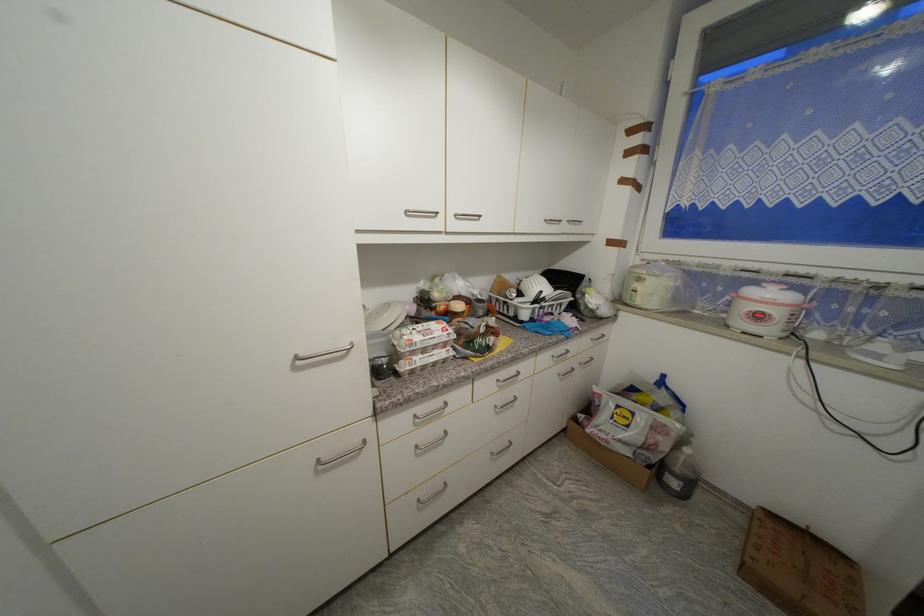
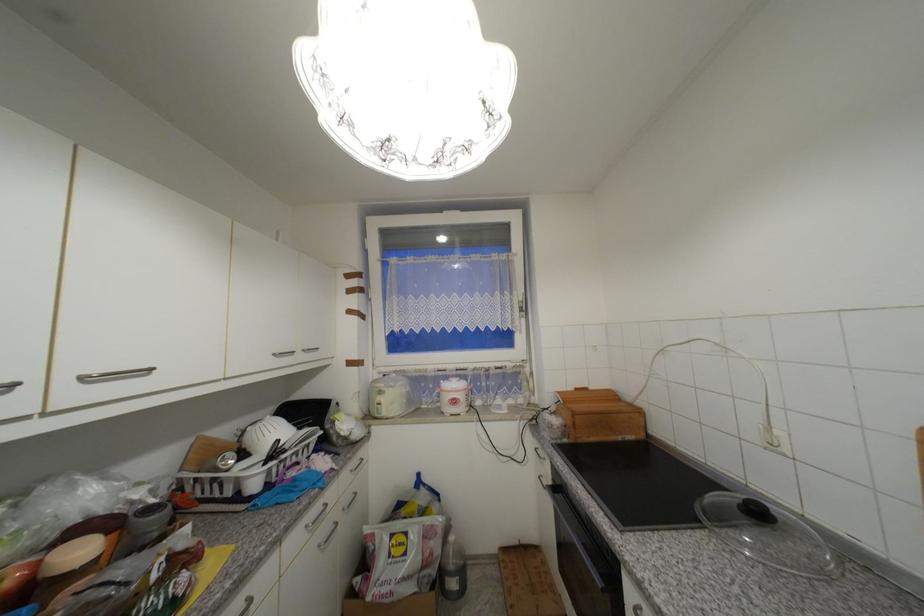
Find the pixel in the second image that matches (462,217) in the first image.

(89, 379)